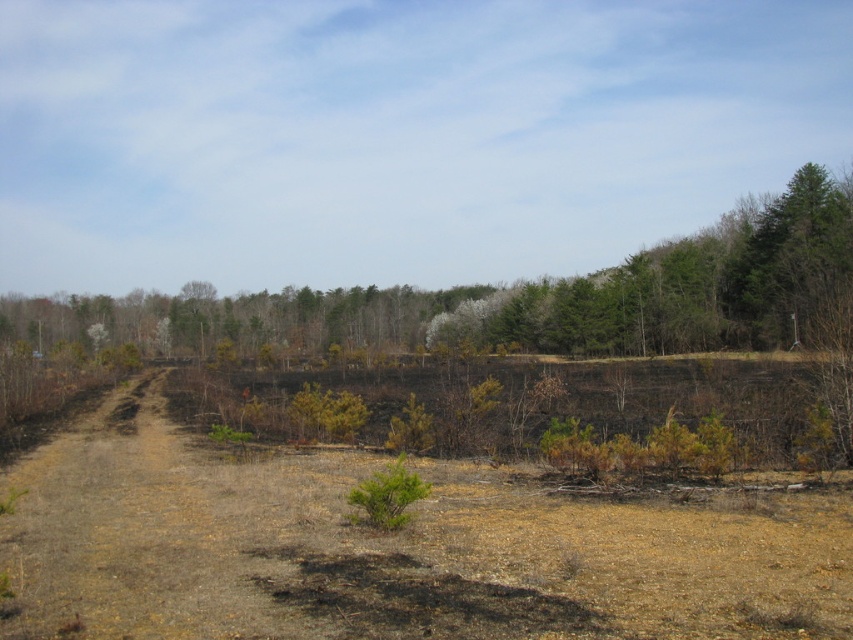
Is brown dry grass at center to the right of green matte tree at upper right from the viewer's perspective?

Incorrect, brown dry grass at center is not on the right side of green matte tree at upper right.

Who is more forward, [247,513] or [782,340]?

Point [247,513]

You are a GUI agent. You are given a task and a screenshot of the screen. Output one action in this format:
    pyautogui.click(x=<x>, y=<y>)
    Task: Click on the brown dry grass at center
    The width and height of the screenshot is (853, 640).
    Given the screenshot: What is the action you would take?
    pyautogui.click(x=390, y=548)